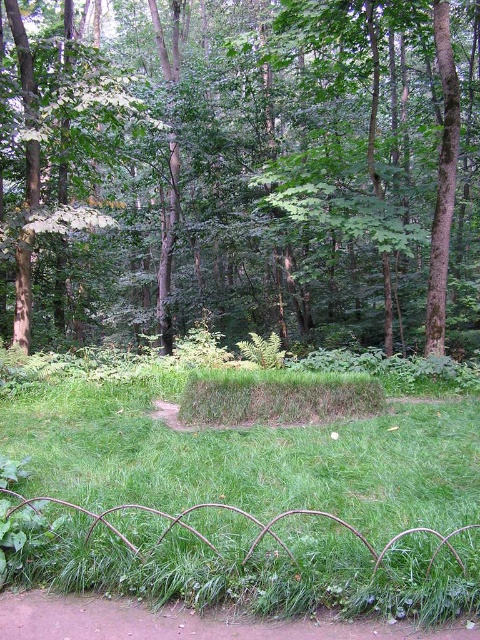
Can you confirm if green leafy tree at center is positioned below green grassy mound at center?

No.

Where is `green leafy tree at center`? The image size is (480, 640). green leafy tree at center is located at coordinates (250, 172).

Does green leafy tree at center appear on the right side of brown dirt path at lower left?

Yes, green leafy tree at center is to the right of brown dirt path at lower left.

Between green leafy tree at center and brown dirt path at lower left, which one has less height?

With less height is brown dirt path at lower left.

Who is more forward, (419, 173) or (25, 598)?

Point (25, 598) is more forward.

The height and width of the screenshot is (640, 480). Find the location of `green leafy tree at center`. green leafy tree at center is located at coordinates (250, 172).

Can you confirm if green grassy mound at center is shorter than brown dirt path at lower left?

No.

Measure the distance between point (165, 442) and camera.

The distance of point (165, 442) from camera is 5.64 meters.

The height and width of the screenshot is (640, 480). I want to click on green grassy mound at center, so click(250, 460).